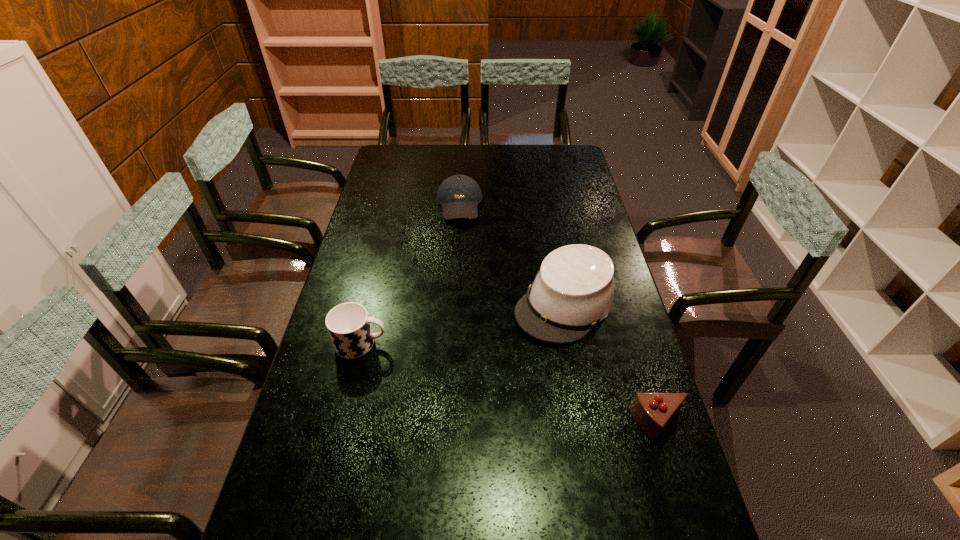
This screenshot has width=960, height=540. Find the location of `vacant space on the desktop that is between the cup and the chocolate cake and is positioned on the front-facing side of the hat`. vacant space on the desktop that is between the cup and the chocolate cake and is positioned on the front-facing side of the hat is located at coordinates (491, 379).

The image size is (960, 540). Find the location of `free spot on the desktop that is between the cup and the chocolate cake and is positioned on the front-facing side of the baseball cap`. free spot on the desktop that is between the cup and the chocolate cake and is positioned on the front-facing side of the baseball cap is located at coordinates (466, 372).